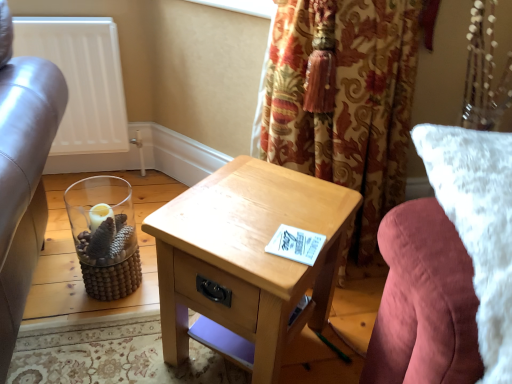
Question: Is light wood/texture nightstand at center looking in the opposite direction of white matte radiator at upper left?

Choices:
 (A) no
 (B) yes

Answer: (A)

Question: Is light wood/texture nightstand at center outside of white matte radiator at upper left?

Choices:
 (A) no
 (B) yes

Answer: (B)

Question: From the image's perspective, is light wood/texture nightstand at center located beneath white matte radiator at upper left?

Choices:
 (A) no
 (B) yes

Answer: (B)

Question: Can you confirm if light wood/texture nightstand at center is smaller than white matte radiator at upper left?

Choices:
 (A) yes
 (B) no

Answer: (B)

Question: From the image's perspective, is light wood/texture nightstand at center on top of white matte radiator at upper left?

Choices:
 (A) no
 (B) yes

Answer: (A)

Question: From a real-world perspective, is white matte radiator at upper left above or below light wood/texture nightstand at center?

Choices:
 (A) below
 (B) above

Answer: (B)

Question: Choose the correct answer: Is white matte radiator at upper left inside light wood/texture nightstand at center or outside it?

Choices:
 (A) inside
 (B) outside

Answer: (B)

Question: Would you say white matte radiator at upper left is to the left or to the right of light wood/texture nightstand at center in the picture?

Choices:
 (A) left
 (B) right

Answer: (A)

Question: Is white matte radiator at upper left in front of or behind light wood/texture nightstand at center in the image?

Choices:
 (A) behind
 (B) front

Answer: (A)

Question: Would you say white matte radiator at upper left is to the left or to the right of white fluffy pillow at right in the picture?

Choices:
 (A) left
 (B) right

Answer: (A)

Question: Looking at their shapes, would you say white matte radiator at upper left is wider or thinner than white fluffy pillow at right?

Choices:
 (A) thin
 (B) wide

Answer: (A)

Question: Considering the positions of white matte radiator at upper left and white fluffy pillow at right in the image, is white matte radiator at upper left taller or shorter than white fluffy pillow at right?

Choices:
 (A) short
 (B) tall

Answer: (A)

Question: Based on their sizes in the image, would you say white matte radiator at upper left is bigger or smaller than white fluffy pillow at right?

Choices:
 (A) big
 (B) small

Answer: (B)

Question: Would you say white fluffy pillow at right is to the left or to the right of white matte radiator at upper left in the picture?

Choices:
 (A) left
 (B) right

Answer: (B)

Question: Does point (443, 364) appear closer or farther from the camera than point (77, 112)?

Choices:
 (A) closer
 (B) farther

Answer: (A)